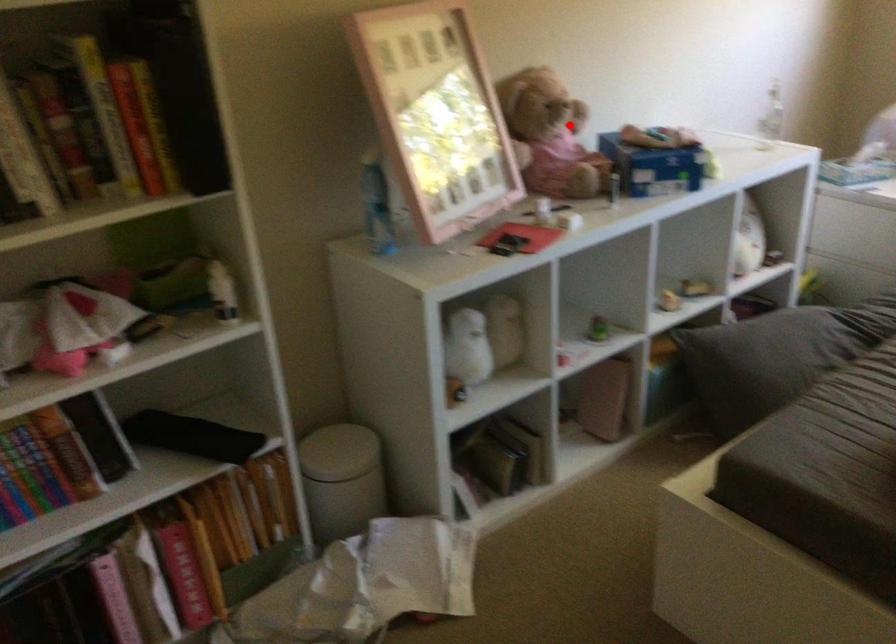
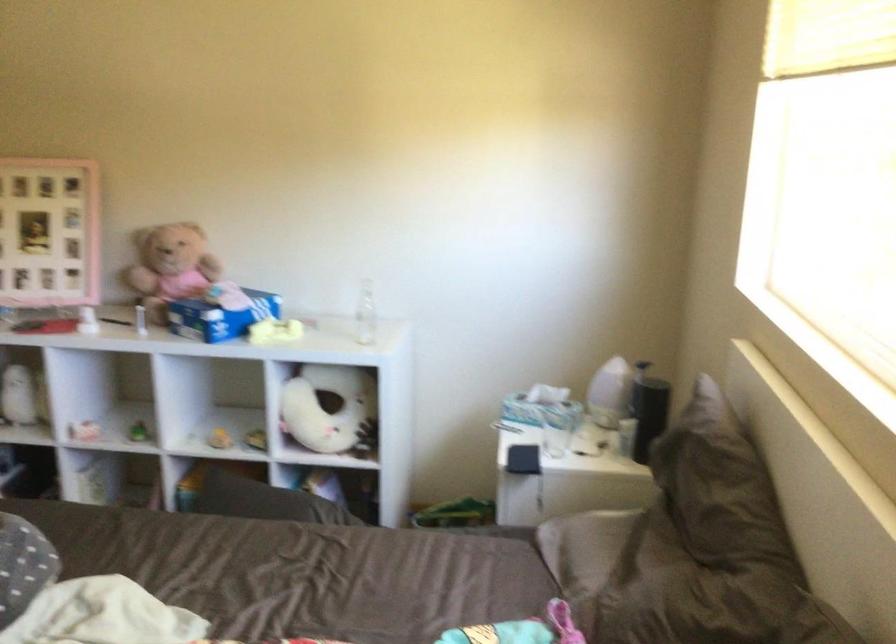
Question: I am providing you with two images of the same scene from different viewpoints. Image1 has a red point marked. In image2, the corresponding 3D location appears at what relative position? Reply with the corresponding letter.

Choices:
 (A) Closer
 (B) Farther

Answer: (B)